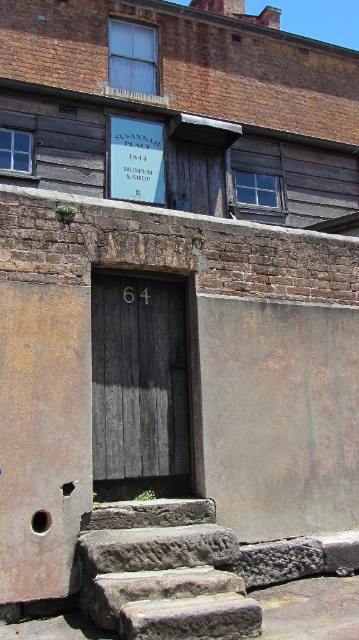
Question: Can you confirm if rusty stone stairs at lower left is smaller than weathered wood door at center?

Choices:
 (A) no
 (B) yes

Answer: (A)

Question: Among these points, which one is farthest from the camera?

Choices:
 (A) (173, 413)
 (B) (155, 529)

Answer: (A)

Question: Which of the following is the farthest from the observer?

Choices:
 (A) 150,593
 (B) 141,474

Answer: (B)

Question: Is rusty stone stairs at lower left bigger than weathered wood door at center?

Choices:
 (A) no
 (B) yes

Answer: (B)

Question: Which of the following is the closest to the observer?

Choices:
 (A) rusty stone stairs at lower left
 (B) weathered wood door at center

Answer: (A)

Question: Does rusty stone stairs at lower left have a smaller size compared to weathered wood door at center?

Choices:
 (A) no
 (B) yes

Answer: (A)